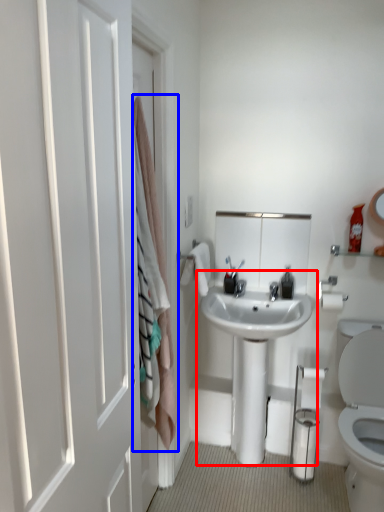
Question: Which of the following is the farthest to the observer, sink (highlighted by a red box) or curtain (highlighted by a blue box)?

Choices:
 (A) sink
 (B) curtain

Answer: (A)